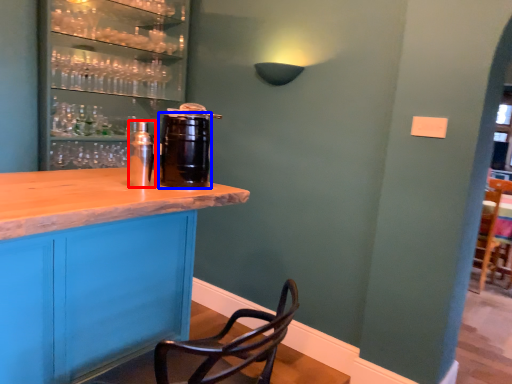
Question: Among these objects, which one is farthest to the camera, beverage (highlighted by a red box) or beverage (highlighted by a blue box)?

Choices:
 (A) beverage
 (B) beverage

Answer: (A)